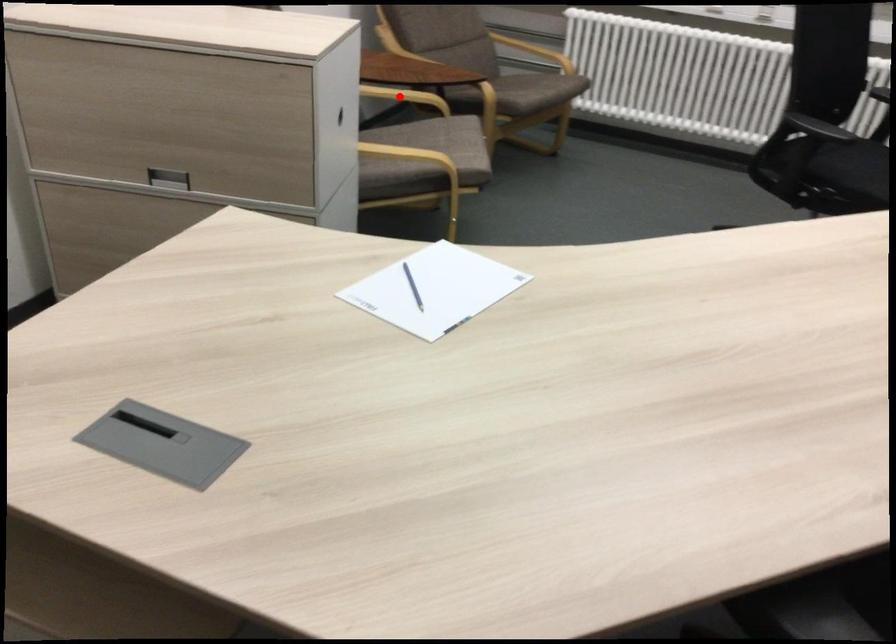
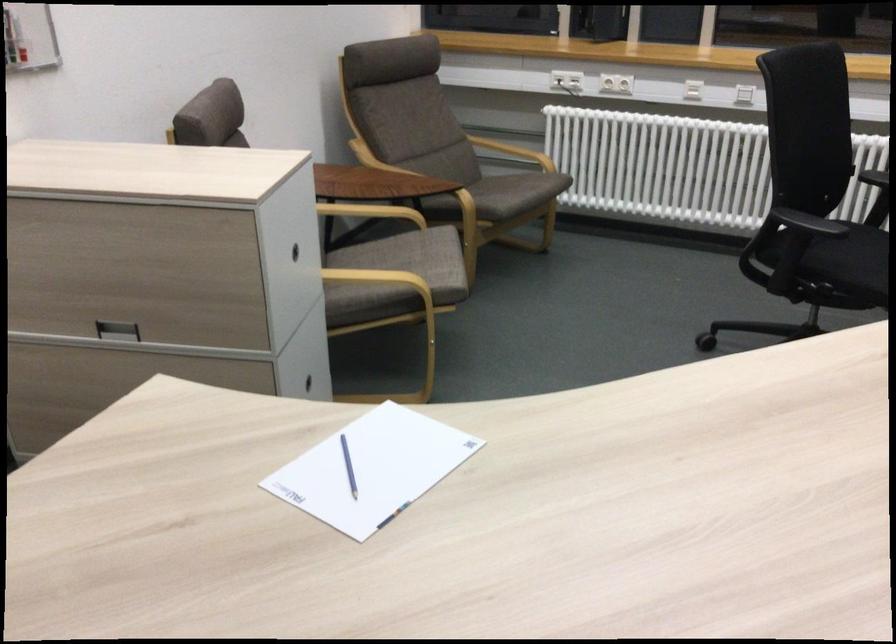
The point at the highlighted location is marked in the first image. Where is the corresponding point in the second image?

(371, 212)